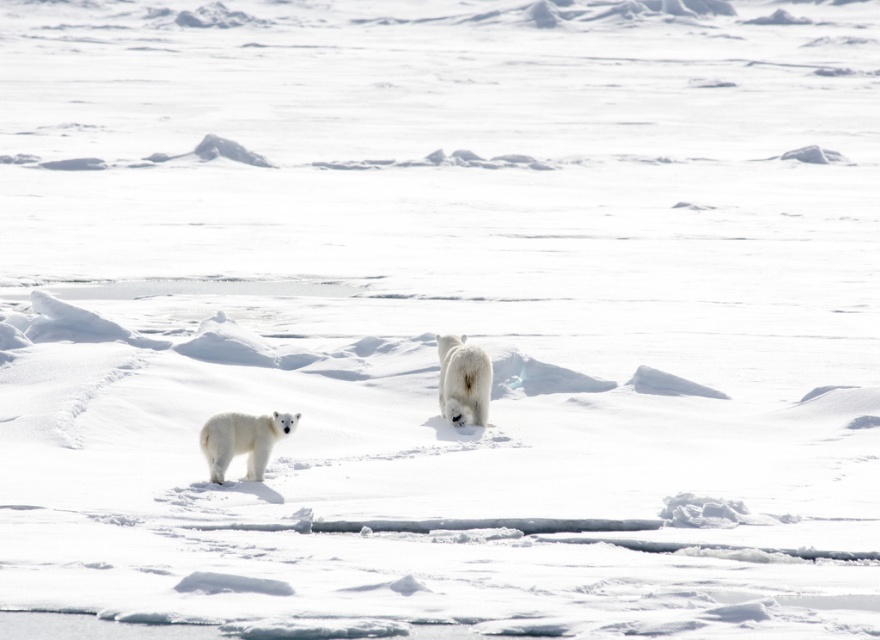
Between white fluffy bear cub at lower left and white fluffy bear at center, which one has more height?

Standing taller between the two is white fluffy bear at center.

Can you confirm if white fluffy bear cub at lower left is wider than white fluffy bear at center?

Yes, white fluffy bear cub at lower left is wider than white fluffy bear at center.

Where is `white fluffy bear cub at lower left`? white fluffy bear cub at lower left is located at coordinates (242, 440).